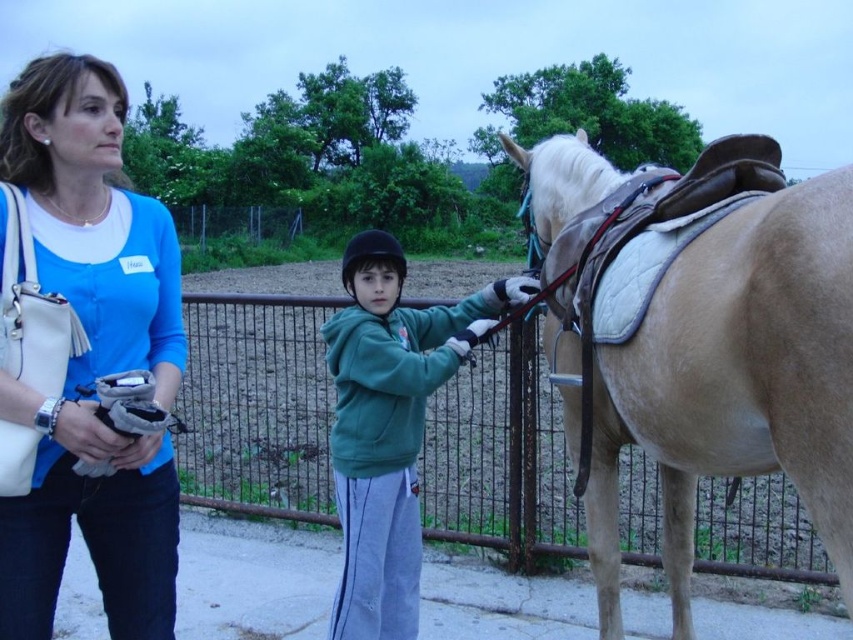
How distant is rusty metal fence at center from green fleece jacket at center?

6.77 meters

Which is behind, point (438, 465) or point (456, 348)?

Positioned behind is point (438, 465).

Is point (488, 513) in front of point (437, 332)?

No, (488, 513) is behind (437, 332).

Where is `rusty metal fence at center`? The width and height of the screenshot is (853, 640). rusty metal fence at center is located at coordinates (257, 404).

Does light brown leather saddle at right lie in front of blue fabric shirt at upper left?

That is True.

Can you confirm if light brown leather saddle at right is wider than blue fabric shirt at upper left?

In fact, light brown leather saddle at right might be narrower than blue fabric shirt at upper left.

At what (x,y) coordinates should I click in order to perform the action: click on light brown leather saddle at right. Please return your answer as a coordinate pair (x, y). This screenshot has width=853, height=640. Looking at the image, I should click on (735, 381).

Where is `light brown leather saddle at right`? The width and height of the screenshot is (853, 640). light brown leather saddle at right is located at coordinates (735, 381).

Does blue fabric shirt at upper left have a lesser height compared to green fleece jacket at center?

In fact, blue fabric shirt at upper left may be taller than green fleece jacket at center.

Based on the photo, between blue fabric shirt at upper left and green fleece jacket at center, which one is positioned higher?

green fleece jacket at center

Is point (100, 237) more distant than point (376, 593)?

That is False.

I want to click on blue fabric shirt at upper left, so click(x=91, y=356).